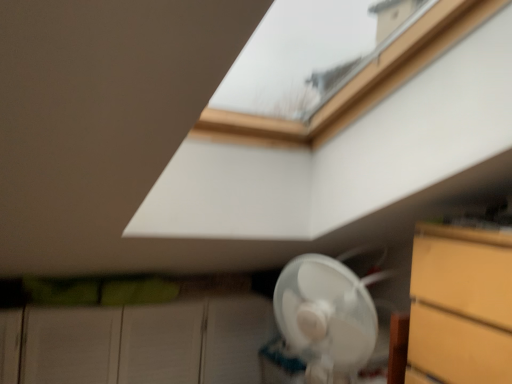
What do you see at coordinates (138, 343) in the screenshot? The width and height of the screenshot is (512, 384). I see `white glossy cabinet at lower left` at bounding box center [138, 343].

The image size is (512, 384). Identify the location of white glossy cabinet at lower left. (138, 343).

The height and width of the screenshot is (384, 512). Find the location of `white glossy cabinet at lower left`. white glossy cabinet at lower left is located at coordinates (138, 343).